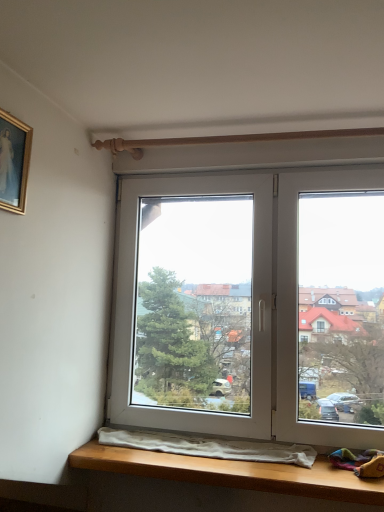
What do you see at coordinates (14, 162) in the screenshot?
I see `gold-framed painting at upper left` at bounding box center [14, 162].

At what (x,y) coordinates should I click in order to perform the action: click on gold-framed painting at upper left. Please return your answer as a coordinate pair (x, y). Looking at the image, I should click on (14, 162).

Measure the distance between gold-framed painting at upper left and camera.

The distance of gold-framed painting at upper left from camera is 3.78 feet.

Where is `gold-framed painting at upper left`? The width and height of the screenshot is (384, 512). gold-framed painting at upper left is located at coordinates (14, 162).